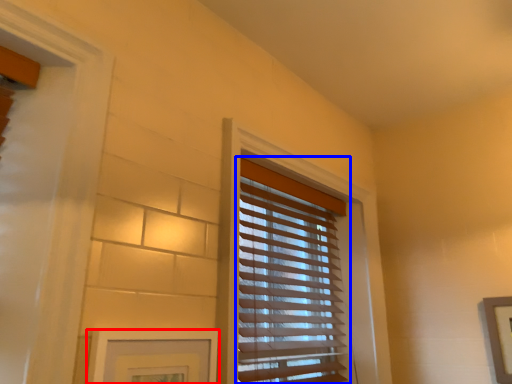
Question: Which of the following is the farthest to the observer, picture frame (highlighted by a red box) or window blind (highlighted by a blue box)?

Choices:
 (A) picture frame
 (B) window blind

Answer: (B)